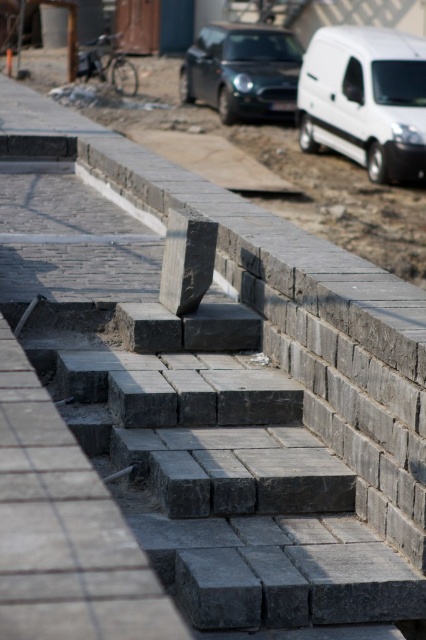
Question: Which point is farther to the camera?

Choices:
 (A) (380, 132)
 (B) (215, 102)

Answer: (B)

Question: Does white matte van at upper right appear on the left side of metallic silver car at center?

Choices:
 (A) yes
 (B) no

Answer: (B)

Question: Can you confirm if white matte van at upper right is bigger than metallic silver car at center?

Choices:
 (A) yes
 (B) no

Answer: (B)

Question: Does white matte van at upper right have a lesser width compared to metallic silver car at center?

Choices:
 (A) yes
 (B) no

Answer: (A)